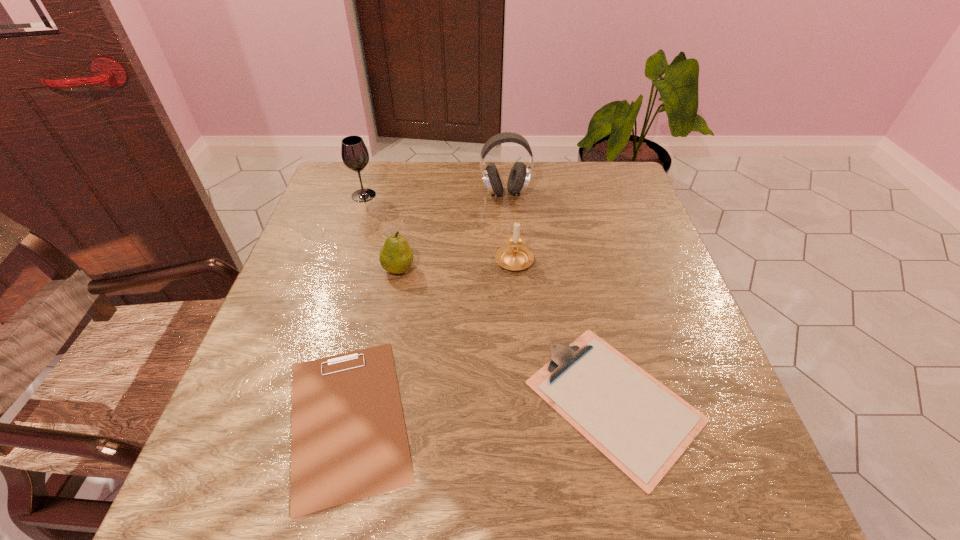
Where is `object at the right edge`? object at the right edge is located at coordinates (641, 426).

I want to click on object located at the far left corner, so click(x=355, y=156).

Where is `object that is at the near left corner`? object that is at the near left corner is located at coordinates (348, 442).

What are the coordinates of `object that is at the near right corner` in the screenshot? It's located at (641, 426).

Locate an element on the screen. vacant space at the far edge of the desktop is located at coordinates (575, 194).

At what (x,y) coordinates should I click in order to perform the action: click on free location at the near edge. Please return your answer as a coordinate pair (x, y). The image size is (960, 540). Looking at the image, I should click on (619, 472).

The width and height of the screenshot is (960, 540). In the image, there is a desktop. What are the coordinates of `vacant area at the left edge` in the screenshot? It's located at (281, 315).

I want to click on free spot at the right edge of the desktop, so click(675, 285).

Where is `blank space at the far right corner`? Image resolution: width=960 pixels, height=540 pixels. blank space at the far right corner is located at coordinates (599, 174).

In order to click on vacant space at the near right corner in this screenshot , I will do `click(750, 511)`.